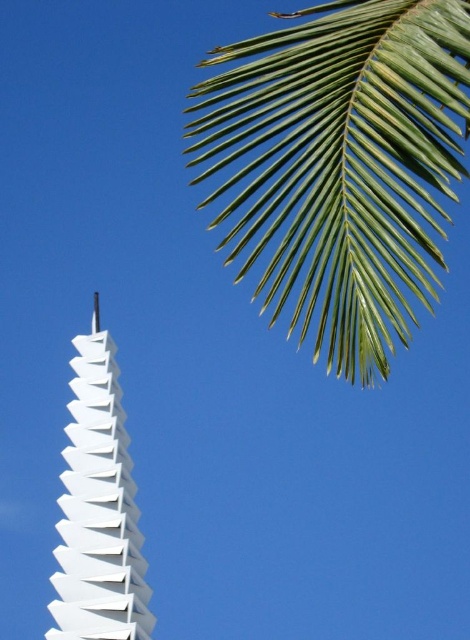
Does green leafy palm at upper right have a lesser width compared to white matte pyramid at center?

Incorrect, green leafy palm at upper right's width is not less than white matte pyramid at center's.

Does green leafy palm at upper right have a greater width compared to white matte pyramid at center?

Correct, the width of green leafy palm at upper right exceeds that of white matte pyramid at center.

The height and width of the screenshot is (640, 470). Find the location of `green leafy palm at upper right`. green leafy palm at upper right is located at coordinates (342, 163).

Where is `green leafy palm at upper right`? green leafy palm at upper right is located at coordinates pos(342,163).